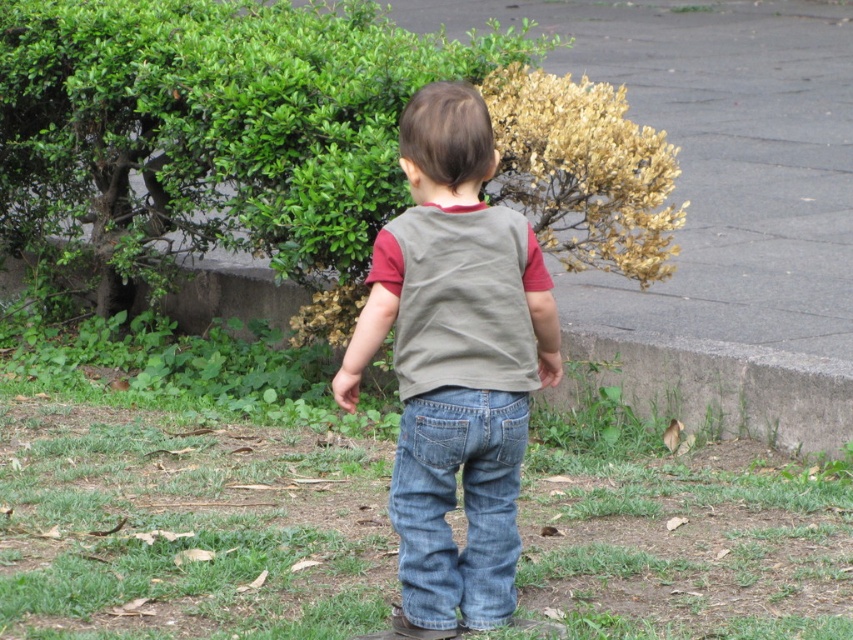
You are a drone operator trying to capture a photo of the child while avoiding the grass. Based on the coordinates provided, where should you position the drone to ensure it doesn not hover over the green grass at lower center?

The green grass at lower center is located at point (x=183, y=493), so you should position the drone away from that coordinate to avoid hovering over it.